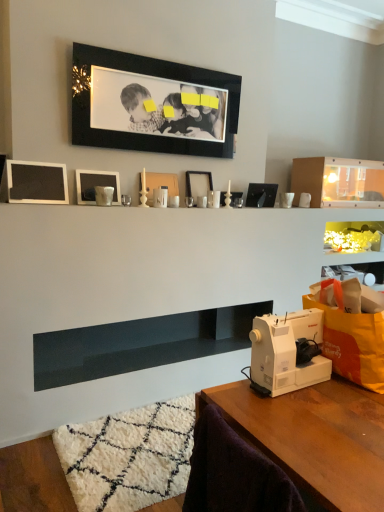
Question: Is matte black picture frame at center, positioned as the 2th picture frame in right-to-left order, inside or outside of white plastic sewing machine at lower right?

Choices:
 (A) outside
 (B) inside

Answer: (A)

Question: Is point (193, 201) closer or farther from the camera than point (306, 329)?

Choices:
 (A) closer
 (B) farther

Answer: (B)

Question: Based on their relative distances, which object is farther from the matte white picture frame at center, which appears as the 4th picture frame when viewed from the right?

Choices:
 (A) white plastic sewing machine at lower right
 (B) black matte picture frame at upper center, arranged as the fourth picture frame when viewed from the left
 (C) smooth dark blue shelf at center, the 2th shelf viewed from the top
 (D) matte silver frame at upper center, placed as the second picture frame when sorted from left to right
 (E) transparent plastic shelf at upper center, the 2th shelf viewed from the left

Answer: (E)

Question: Estimate the real-world distances between objects in this image. Which object is farther from the matte white picture frame at center, which appears as the 4th picture frame when viewed from the right?

Choices:
 (A) matte silver frame at upper center, placed as the second picture frame when sorted from left to right
 (B) white plastic sewing machine at lower right
 (C) matte black frame at left, which is the 6th picture frame in right-to-left order
 (D) wooden table at lower right
 (E) matte black picture frame at center, which is the 1th picture frame from right to left

Answer: (D)